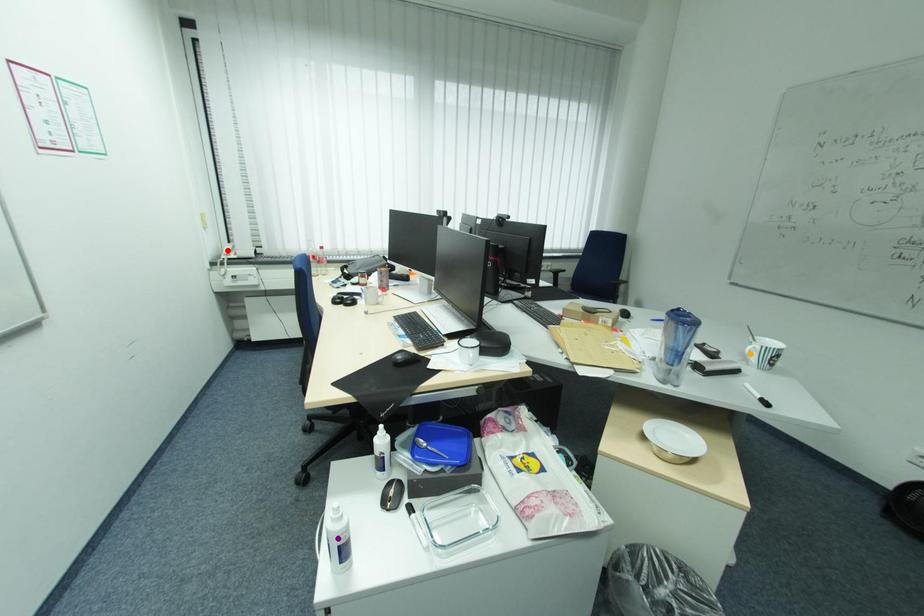
Order these from nearest to farthest:
purple point | orange point | red point

purple point, orange point, red point